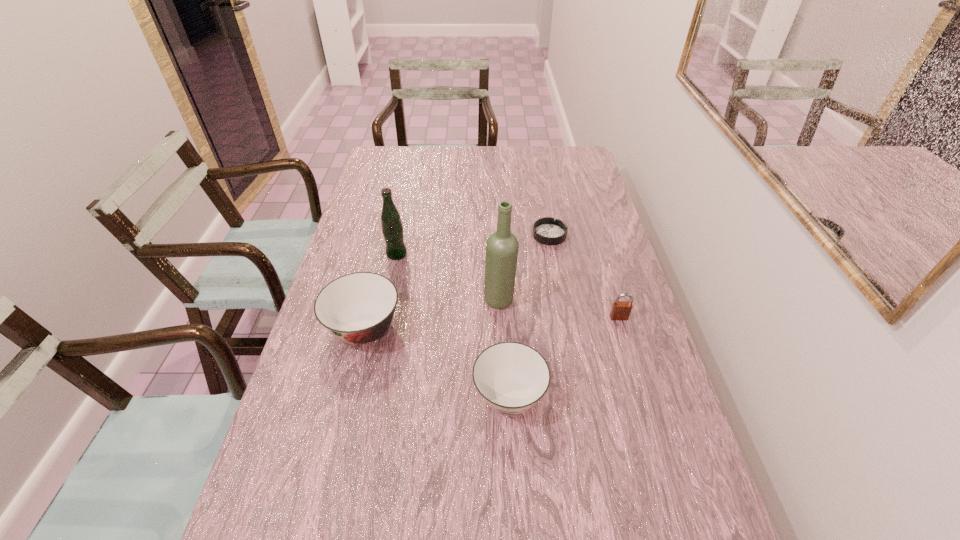
I want to click on the farther soup bowl, so click(x=357, y=308).

This screenshot has width=960, height=540. I want to click on the third tallest object, so (357, 308).

Identify the location of the nearer soup bowl. The image size is (960, 540). (511, 377).

Image resolution: width=960 pixels, height=540 pixels. What are the coordinates of `the shorter soup bowl` in the screenshot? It's located at (511, 377).

You are a GUI agent. You are given a task and a screenshot of the screen. Output one action in this format:
    pyautogui.click(x=<x>, y=<y>)
    Task: Click on the beer bottle
    This screenshot has height=540, width=960.
    Given the screenshot: What is the action you would take?
    pyautogui.click(x=392, y=228)

Find the location of `the second tallest object`. the second tallest object is located at coordinates (392, 228).

The width and height of the screenshot is (960, 540). I want to click on the farthest object, so click(x=548, y=231).

Where is `the shortest object`? Image resolution: width=960 pixels, height=540 pixels. the shortest object is located at coordinates (548, 231).

In order to click on padlock in this screenshot , I will do `click(621, 310)`.

This screenshot has width=960, height=540. I want to click on wine bottle, so click(502, 246).